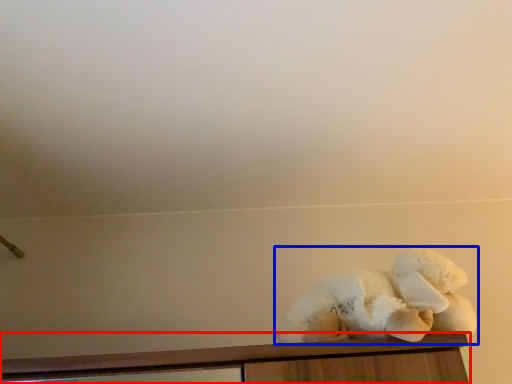
Question: Among these objects, which one is nearest to the camera, furniture (highlighted by a red box) or teddy bear (highlighted by a blue box)?

Choices:
 (A) furniture
 (B) teddy bear

Answer: (A)